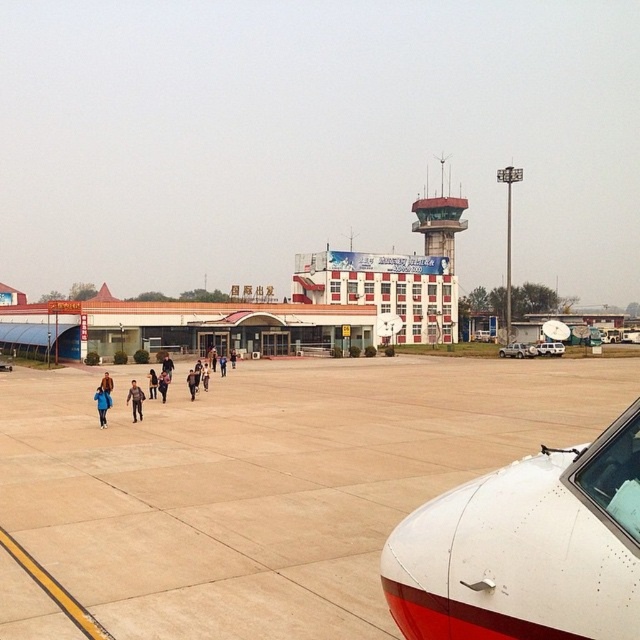
You are standing at the aircraft nose and want to walk directly to the matte red control tower at center. According to the coordinates provided, in which direction should you head?

The matte red control tower at center is located at coordinates point (440, 220), so you should head towards the center of the image to reach it.

Looking at this image, you are standing at the point closer to the camera between the two points, point (621, 490) and point (136, 406). Which point are you standing at?

You are standing at point (621, 490) because it is in front of point (136, 406) from the camera perspective.

You are an airport staff member needing to park a new vehicle that is 2 meters wide. You see the white matte airplane at lower right and the blue matte jacket at lower left. Which object can the new vehicle fit next to without overlapping?

The blue matte jacket at lower left is wider than the white matte airplane at lower right, so the new vehicle can fit next to the blue matte jacket at lower left since it has more space available.